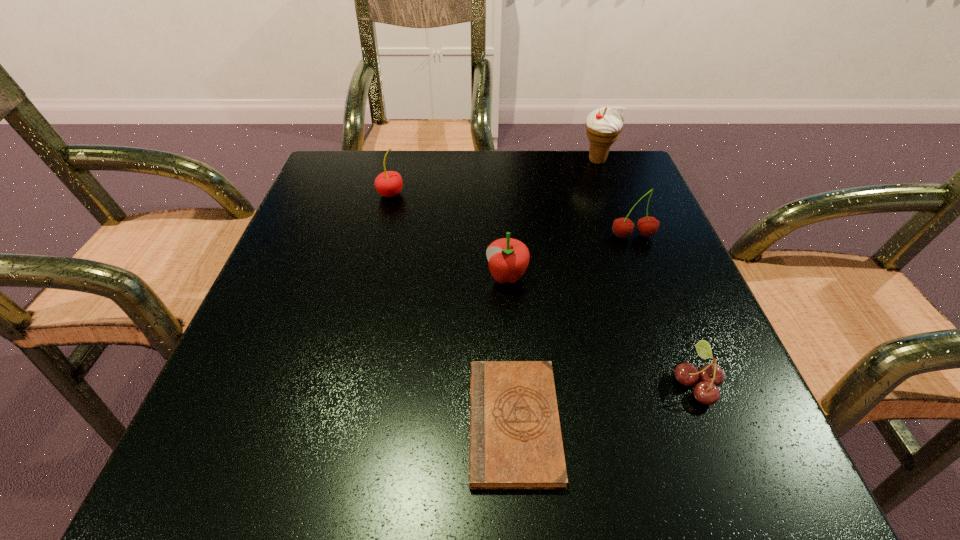
Where is `vacant space located on the left of the icecream`? The height and width of the screenshot is (540, 960). vacant space located on the left of the icecream is located at coordinates (555, 161).

At what (x,y) coordinates should I click in order to perform the action: click on vacant point located 0.230m on the front of the farthest cherry. Please return your answer as a coordinate pair (x, y). Looking at the image, I should click on (370, 278).

The image size is (960, 540). Identify the location of blank space located on the surface of the third farthest object. (646, 272).

Where is `free point located on the left of the apple`? free point located on the left of the apple is located at coordinates (347, 276).

The height and width of the screenshot is (540, 960). In order to click on free space located 0.140m on the leaves of the shortest cherry in this screenshot , I will do `click(576, 383)`.

This screenshot has height=540, width=960. In order to click on free space located 0.100m on the leaves of the shortest cherry in this screenshot , I will do `click(604, 383)`.

Where is `vacant region located 0.360m on the leaves of the shortest cherry`? vacant region located 0.360m on the leaves of the shortest cherry is located at coordinates (423, 383).

Where is `free region located 0.350m on the spine side of the diary`? free region located 0.350m on the spine side of the diary is located at coordinates (210, 423).

At what (x,y) coordinates should I click in order to perform the action: click on vacant area located on the spine side of the diary. Please return your answer as a coordinate pair (x, y). This screenshot has height=540, width=960. Looking at the image, I should click on (389, 423).

Where is `vacant space located 0.290m on the spine side of the diary`? The image size is (960, 540). vacant space located 0.290m on the spine side of the diary is located at coordinates (254, 423).